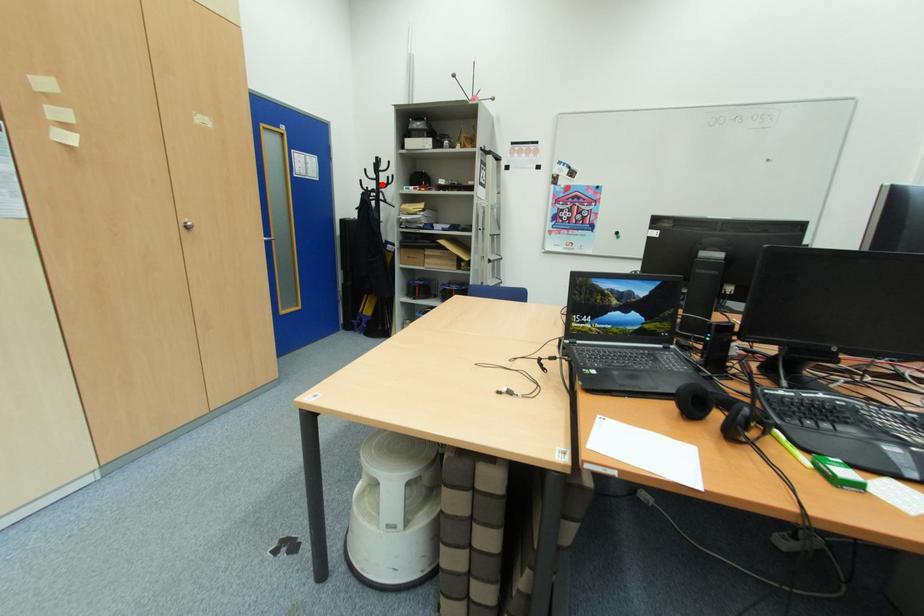
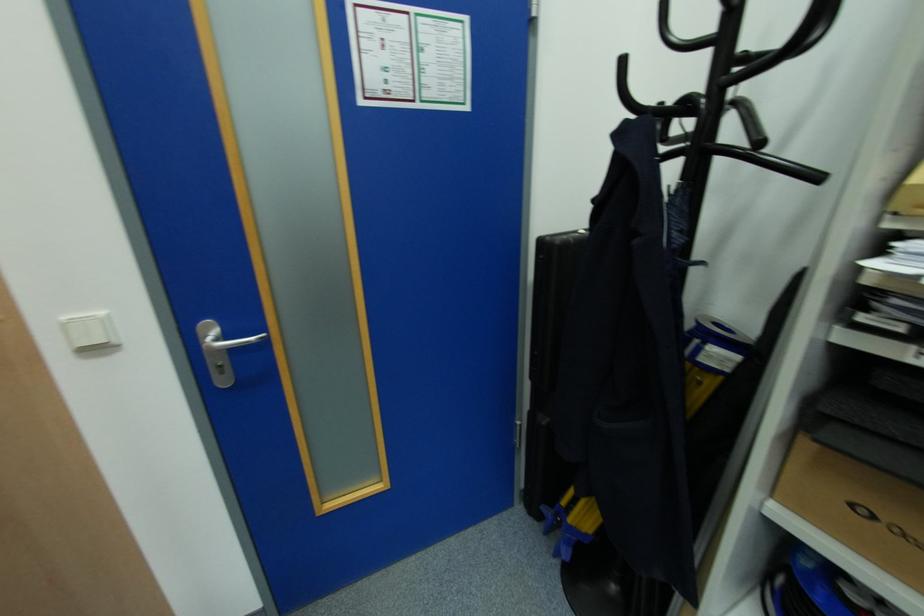
The point at the highlighted location is marked in the first image. Where is the corresponding point in the second image?

(726, 61)